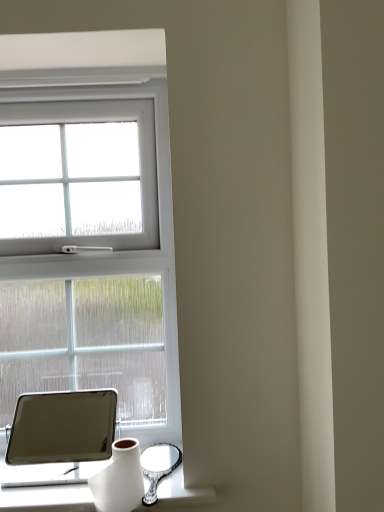
Question: From the image's perspective, is white glossy vase at lower left above or below matte black tablet at lower left?

Choices:
 (A) above
 (B) below

Answer: (B)

Question: Relative to matte black tablet at lower left, is white glossy vase at lower left in front or behind?

Choices:
 (A) behind
 (B) front

Answer: (B)

Question: Is point (130, 504) positioned closer to the camera than point (74, 409)?

Choices:
 (A) closer
 (B) farther

Answer: (A)

Question: From a real-world perspective, is matte black tablet at lower left physically located above or below white glossy vase at lower left?

Choices:
 (A) below
 (B) above

Answer: (B)

Question: In terms of width, does matte black tablet at lower left look wider or thinner when compared to white glossy vase at lower left?

Choices:
 (A) wide
 (B) thin

Answer: (A)

Question: Considering their positions, is matte black tablet at lower left located in front of or behind white glossy vase at lower left?

Choices:
 (A) front
 (B) behind

Answer: (B)

Question: From the image's perspective, is matte black tablet at lower left positioned above or below white glossy vase at lower left?

Choices:
 (A) below
 (B) above

Answer: (B)